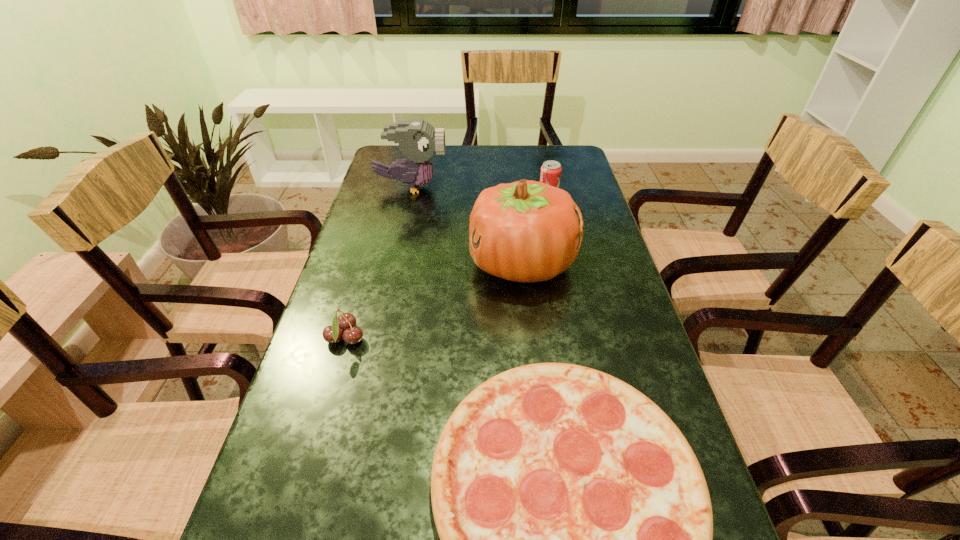
The image size is (960, 540). I want to click on free spot between the pumpkin and the cherry, so click(434, 301).

You are a GUI agent. You are given a task and a screenshot of the screen. Output one action in this format:
    pyautogui.click(x=<x>, y=<y>)
    Task: Click on the vacant space that's between the second nearest object and the bird
    Image resolution: width=960 pixels, height=540 pixels.
    Given the screenshot: What is the action you would take?
    pyautogui.click(x=378, y=263)

I want to click on vacant space in between the third tallest object and the cherry, so click(x=447, y=266).

The image size is (960, 540). Find the location of `vacant space in between the fourth farthest object and the bird`. vacant space in between the fourth farthest object and the bird is located at coordinates click(x=378, y=263).

The height and width of the screenshot is (540, 960). I want to click on free space between the soda can and the cherry, so click(x=447, y=266).

At what (x,y) coordinates should I click in order to perform the action: click on vacant region between the bird and the soda can. Please return your answer as a coordinate pair (x, y). This screenshot has height=540, width=960. Looking at the image, I should click on (480, 191).

Find the location of a particular element. Image resolution: width=960 pixels, height=540 pixels. unoccupied position between the second nearest object and the bird is located at coordinates (378, 263).

The image size is (960, 540). I want to click on unoccupied position between the cherry and the third nearest object, so click(434, 301).

Identify which object is located as the third nearest to the fourth farthest object. Please provide its 2D coordinates. Your answer should be formatted as a tuple, i.e. [(x, y)], where the tuple contains the x and y coordinates of a point satisfying the conditions above.

[(417, 139)]

The image size is (960, 540). Identify the location of object that is the closest to the bird. (527, 231).